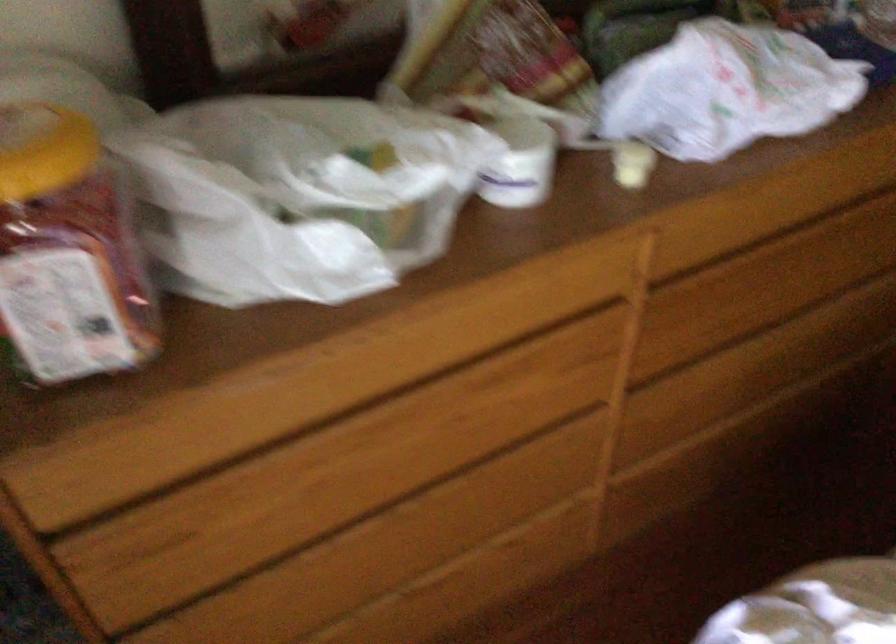
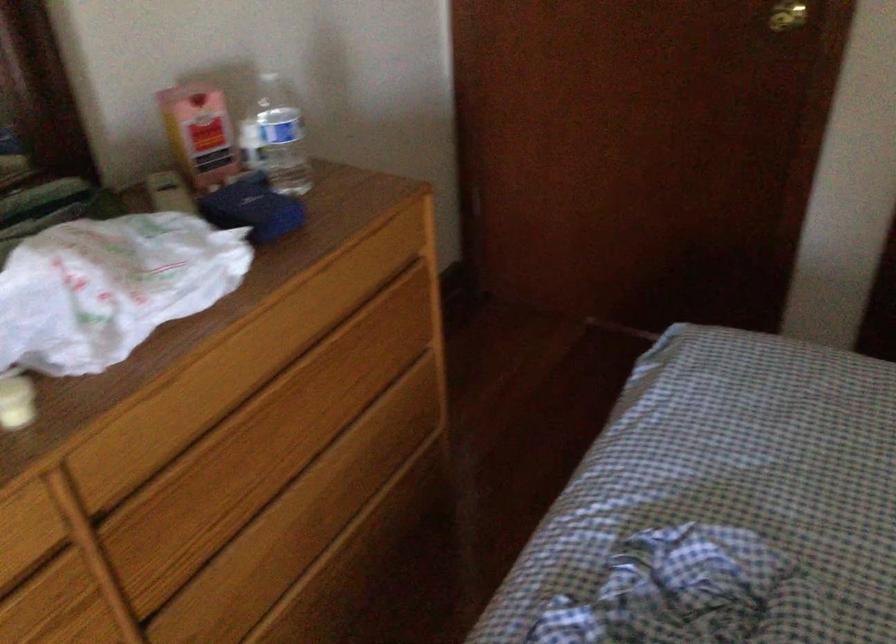
Where in the second image is the point corresponding to (771,292) from the first image?

(263, 456)